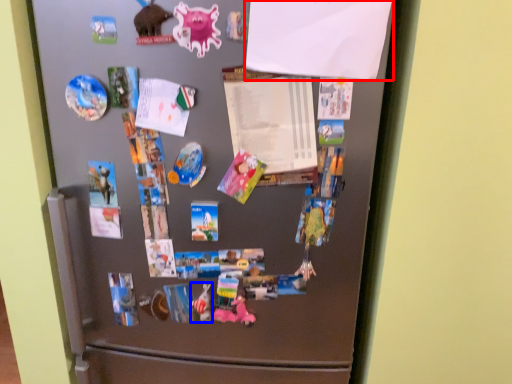
Question: Which object is further to the camera taking this photo, paper (highlighted by a red box) or art (highlighted by a blue box)?

Choices:
 (A) paper
 (B) art

Answer: (B)